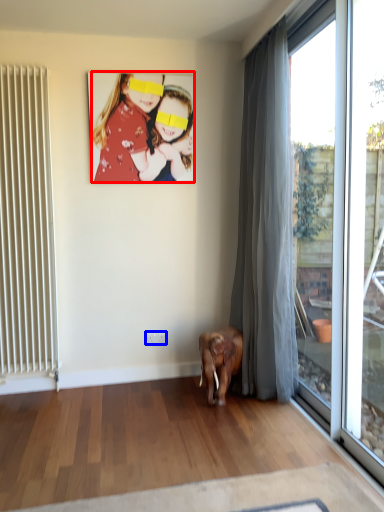
Question: Among these objects, which one is nearest to the camera, person (highlighted by a red box) or power outlet (highlighted by a blue box)?

Choices:
 (A) person
 (B) power outlet

Answer: (A)